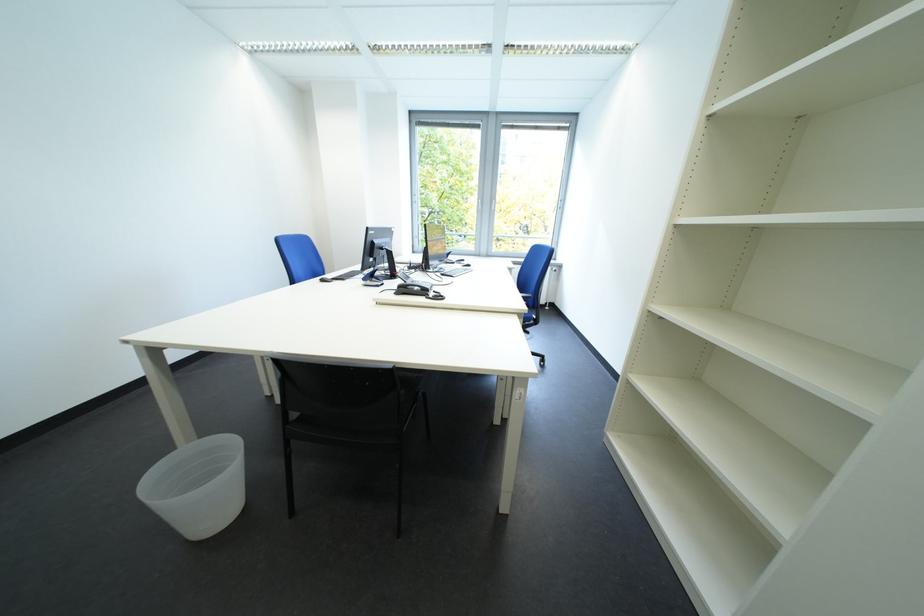
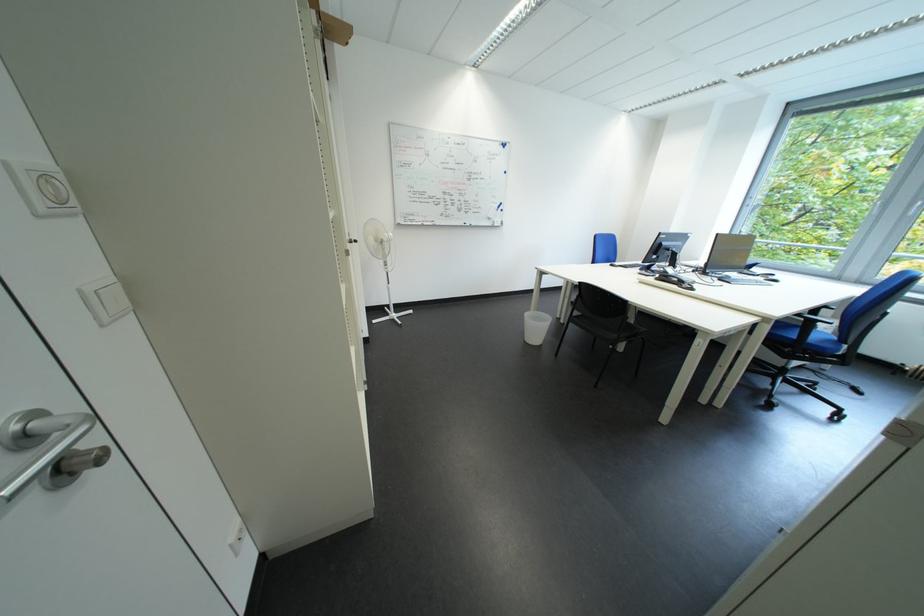
Where in the second image is the point corresponding to the point at 408,296 from the first image?

(669, 282)